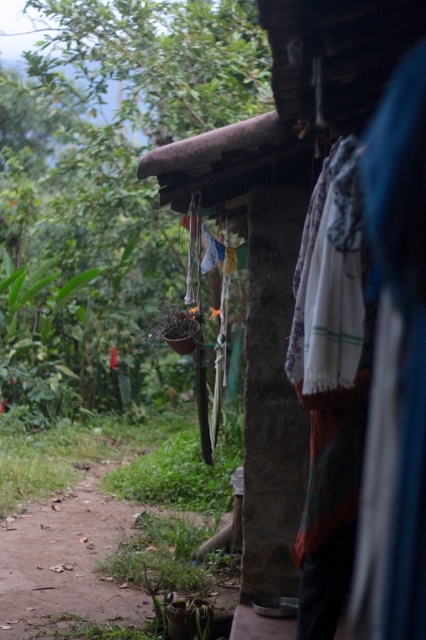
Question: Can you confirm if green leafy plant at center is positioned below rustic wooden hut at center?

Choices:
 (A) no
 (B) yes

Answer: (A)

Question: Does green leafy plant at center appear on the right side of rustic wooden hut at center?

Choices:
 (A) yes
 (B) no

Answer: (B)

Question: Which of the following is the farthest from the observer?

Choices:
 (A) green leafy plant at center
 (B) rustic wooden hut at center

Answer: (A)

Question: From the image, what is the correct spatial relationship of green leafy plant at center in relation to rustic wooden hut at center?

Choices:
 (A) left
 (B) right

Answer: (A)

Question: Which object appears closest to the camera in this image?

Choices:
 (A) green leafy plant at center
 (B) rustic wooden hut at center

Answer: (B)